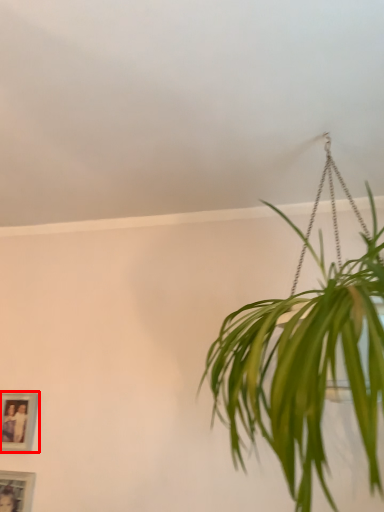
Question: Considering the relative positions of picture frame (annotated by the red box) and picture frame in the image provided, where is picture frame (annotated by the red box) located with respect to the staircase?

Choices:
 (A) right
 (B) left

Answer: (B)